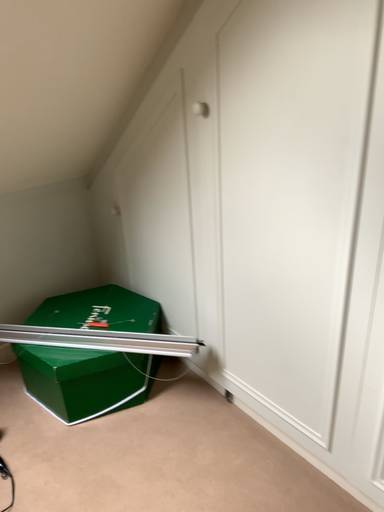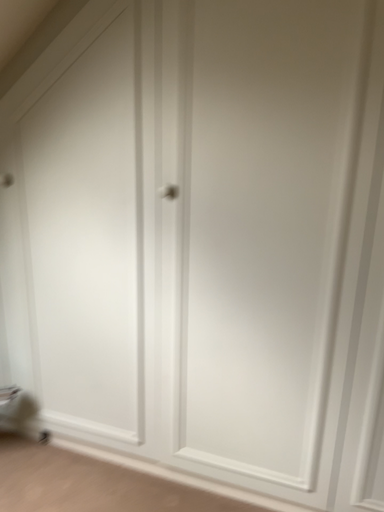
Question: Which way did the camera rotate in the video?

Choices:
 (A) rotated left
 (B) rotated right

Answer: (B)